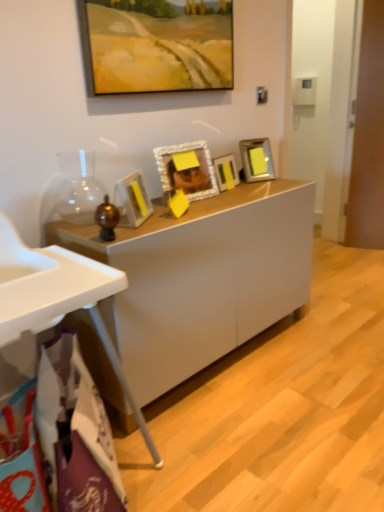
Find the location of a particular element. The width and height of the screenshot is (384, 512). free space in front of white glossy cabinet at center is located at coordinates (261, 433).